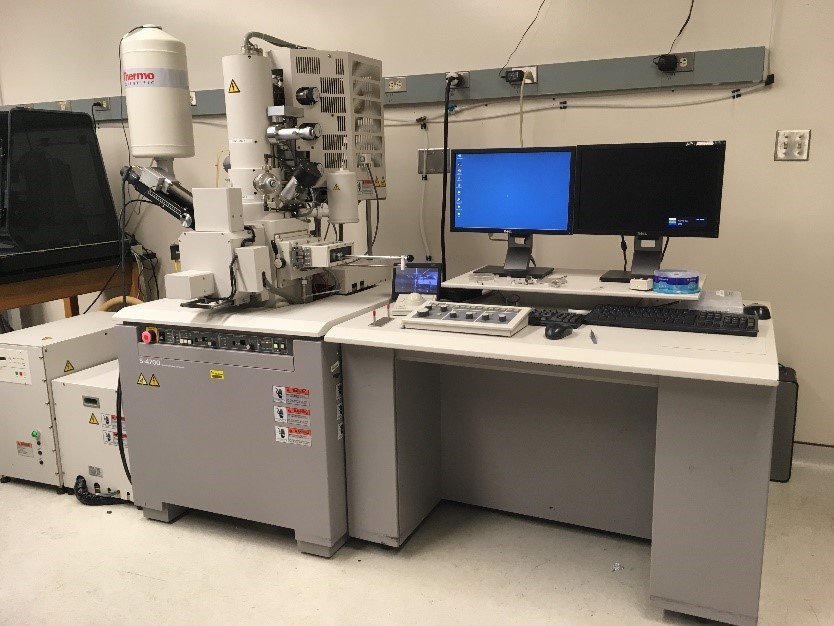
At what (x,y) coordinates should I click in order to perform the action: click on plugs. Please return your answer as a coordinate pair (x, y). Looking at the image, I should click on (453, 85), (518, 95).